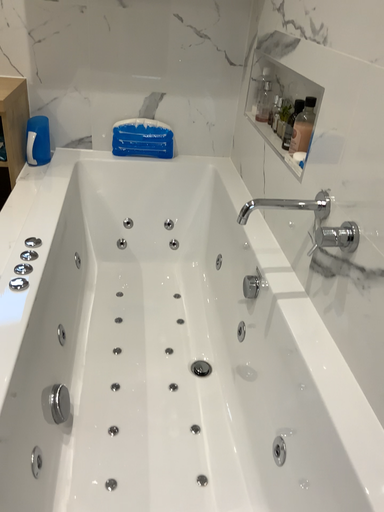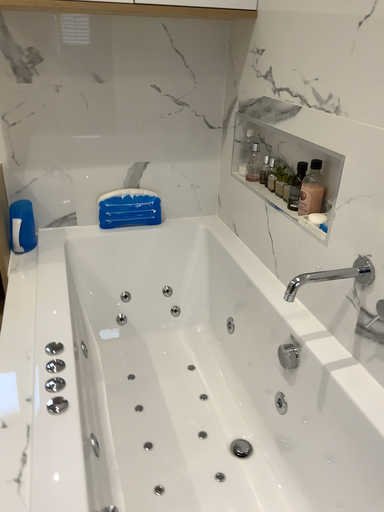
Question: How did the camera likely rotate when shooting the video?

Choices:
 (A) rotated left
 (B) rotated right

Answer: (B)